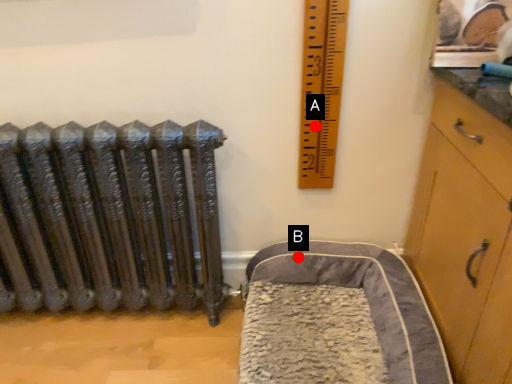
Question: Two points are circled on the image, labeled by A and B beside each circle. Among these points, which one is farthest from the camera?

Choices:
 (A) A is further
 (B) B is further

Answer: (B)